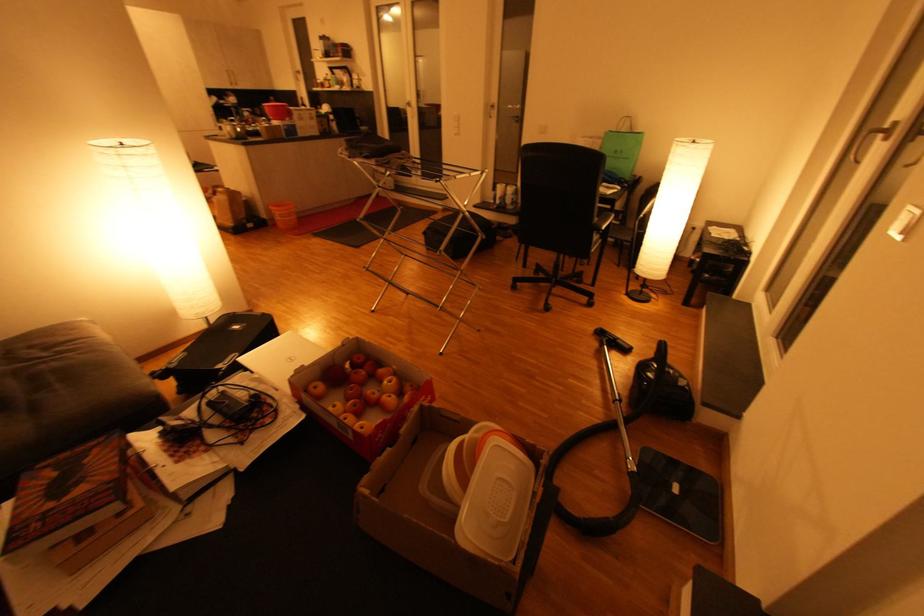
What do you see at coordinates (650, 349) in the screenshot? The image size is (924, 616). I see `the vacuum cleaner handle` at bounding box center [650, 349].